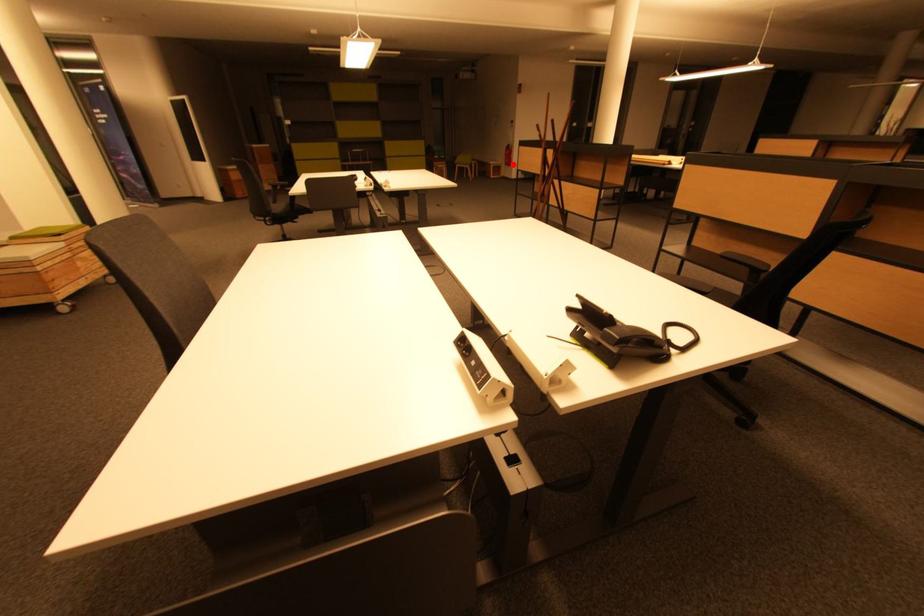
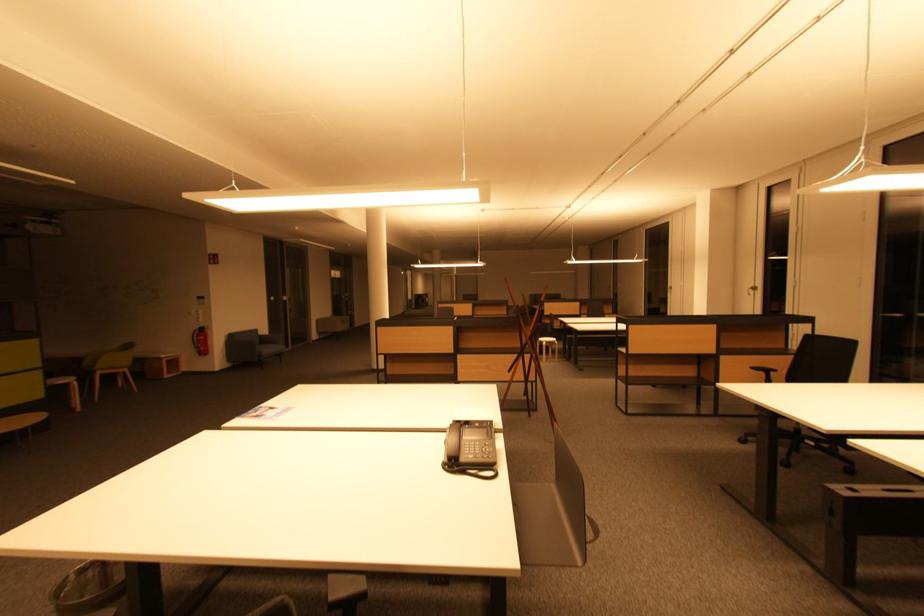
Question: I am providing you with two images of the same scene from different viewpoints. Image1 has a red point marked. In image2, the corresponding 3D location appears at what relative position? Reply with the corresponding letter.

Choices:
 (A) Closer
 (B) Farther

Answer: (B)